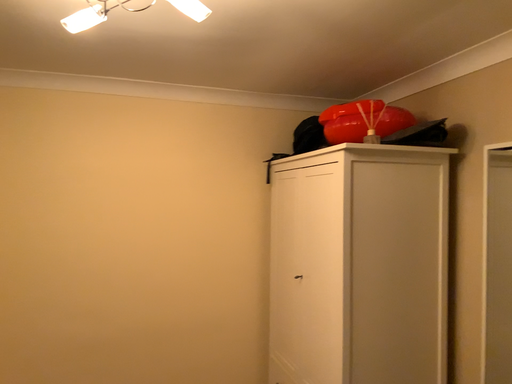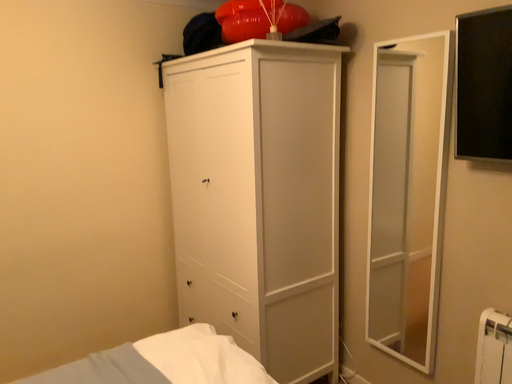
Question: How did the camera likely rotate when shooting the video?

Choices:
 (A) rotated right
 (B) rotated left

Answer: (A)